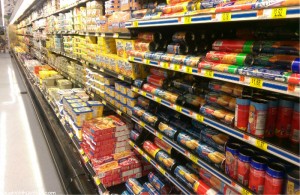
You are a GUI agent. You are given a task and a screenshot of the screen. Output one action in this format:
    pyautogui.click(x=<x>, y=<y>)
    Task: Click on the empty shelf space
    The width and height of the screenshot is (300, 195).
    Given the screenshot: What is the action you would take?
    [x=283, y=146], [x=190, y=106]